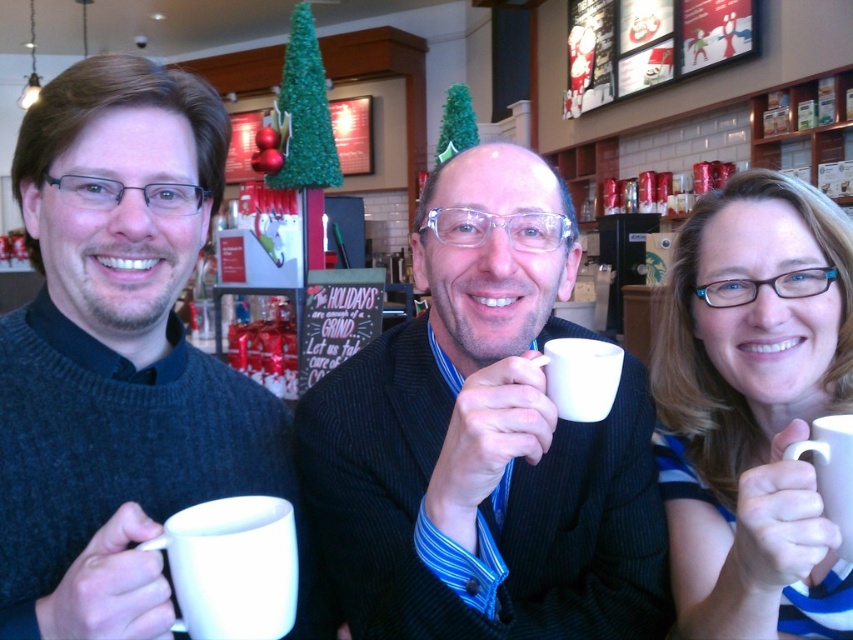
Question: Does matte white mug at center appear on the right side of blue striped shirt at right?

Choices:
 (A) no
 (B) yes

Answer: (A)

Question: Does white matte mug at left come in front of blue striped shirt at right?

Choices:
 (A) yes
 (B) no

Answer: (A)

Question: Which object is the farthest from the blue striped shirt at right?

Choices:
 (A) white matte mug at lower left
 (B) matte white mug at center
 (C) white matte mug at left

Answer: (C)

Question: Which of these objects is positioned closest to the white matte mug at center?

Choices:
 (A) blue striped shirt at right
 (B) white matte mug at left
 (C) white matte mug at lower left

Answer: (A)

Question: Which point appears closest to the camera in this image?

Choices:
 (A) (817, 476)
 (B) (541, 365)
 (C) (184, 524)
 (D) (70, 310)

Answer: (C)

Question: Does white matte mug at center appear under white matte mug at right?

Choices:
 (A) yes
 (B) no

Answer: (B)